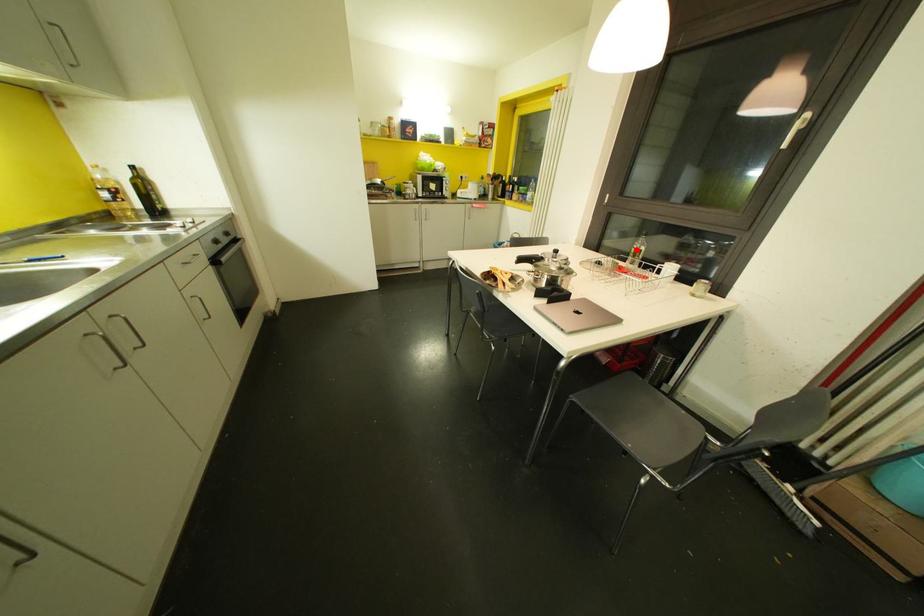
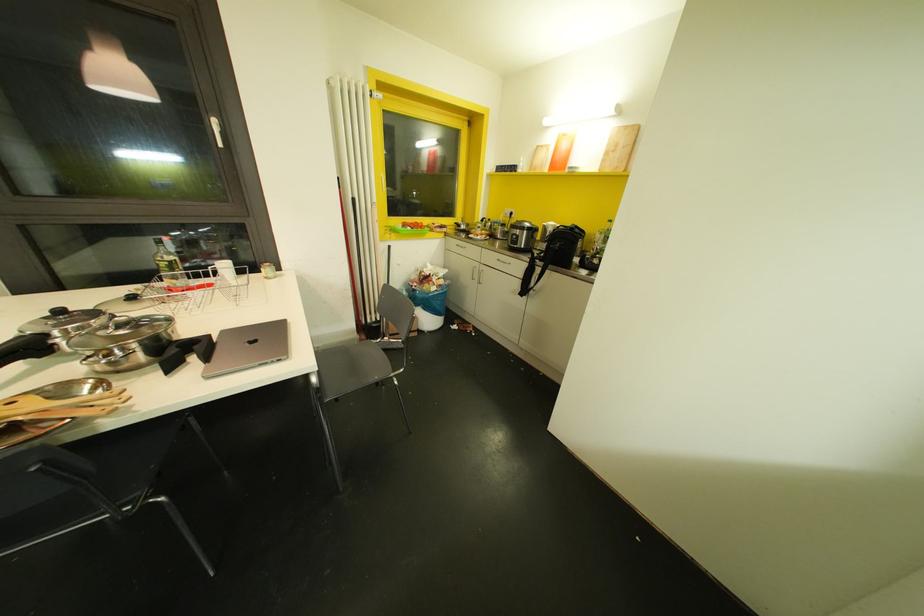
Question: I am providing you with two images of the same scene from different viewpoints. Given a red point in image1, look at the same physical point in image2. Is it:

Choices:
 (A) Closer to the viewpoint
 (B) Farther from the viewpoint

Answer: (B)